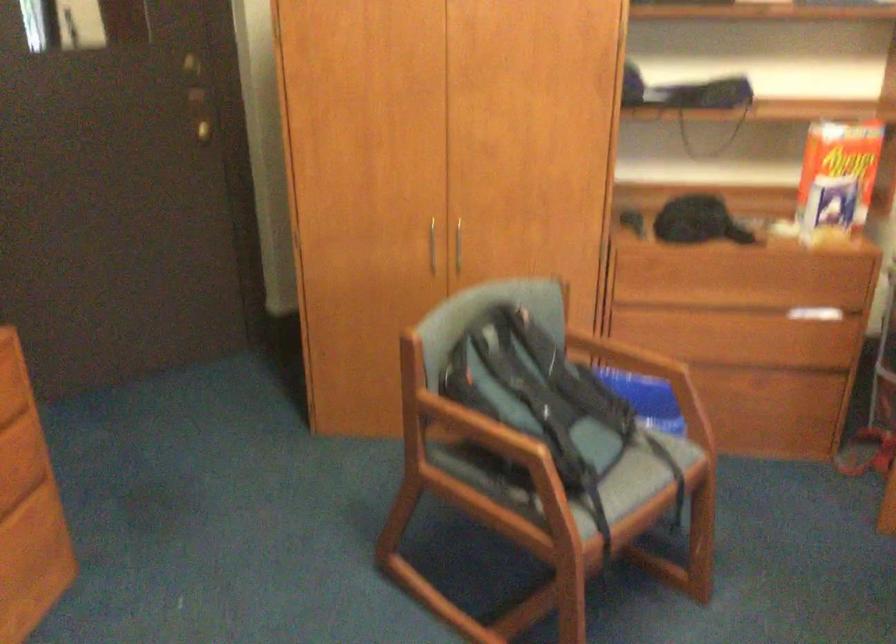
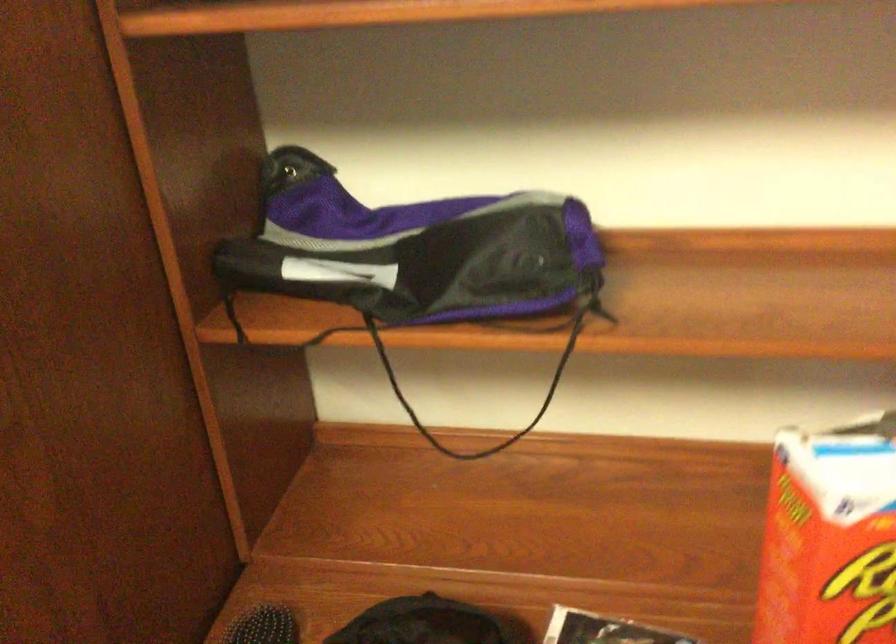
In a continuous first-person perspective shot, in which direction is the camera moving?

The movement direction of the cameraman is right, forward.